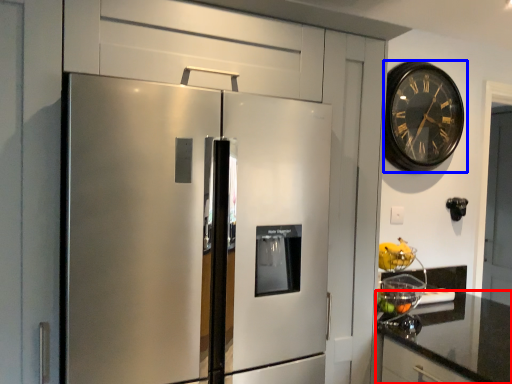
Question: Which object appears closest to the camera in this image, countertop (highlighted by a red box) or wall clock (highlighted by a blue box)?

Choices:
 (A) countertop
 (B) wall clock

Answer: (A)